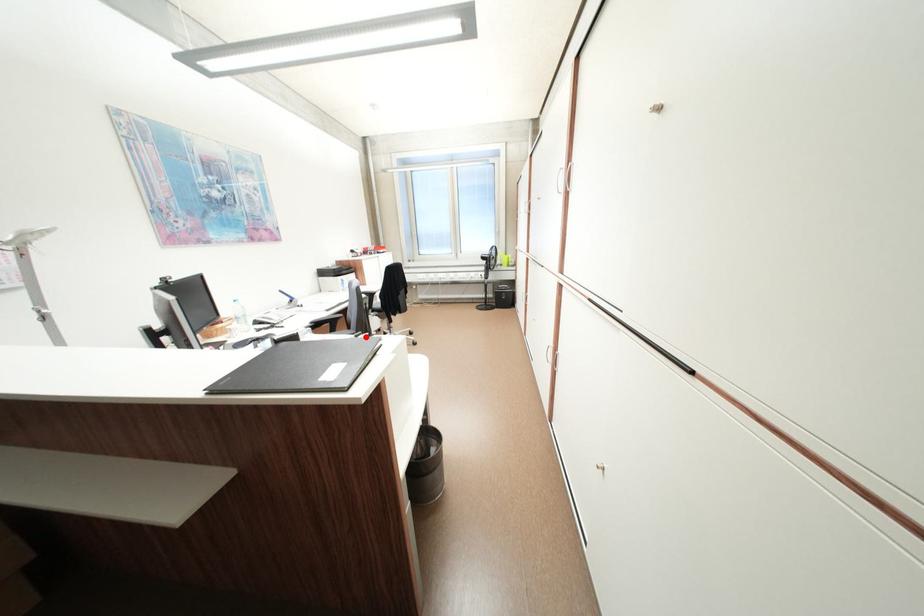
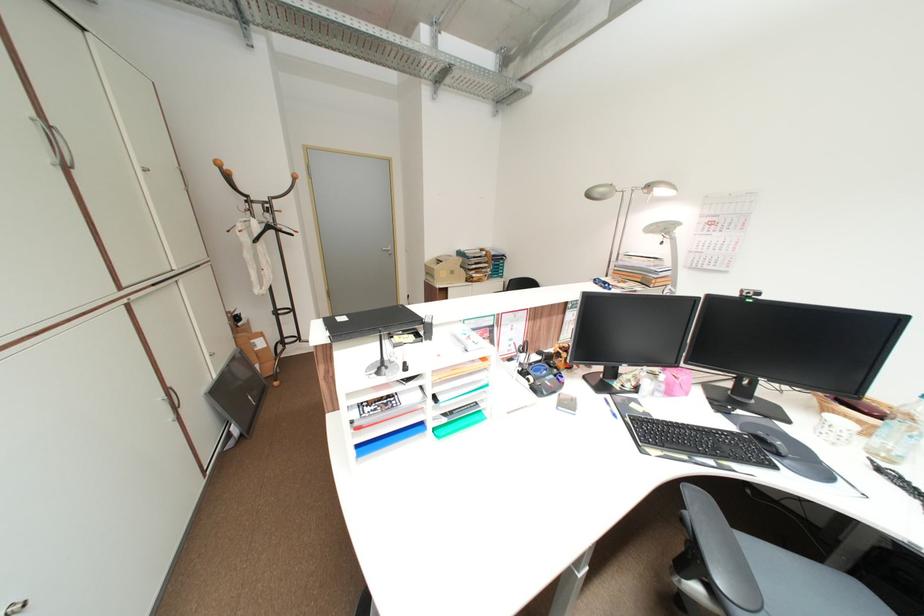
Question: I am providing you with two images of the same scene from different viewpoints. A red point is marked on the first image. At the location where the point appears in image 1, is it still visible in image 2?

Choices:
 (A) Yes
 (B) No

Answer: (B)